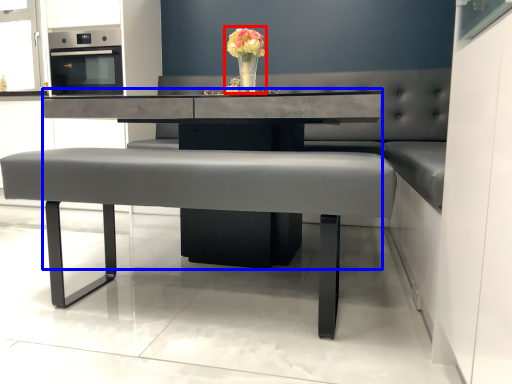
Question: Which point is further to the camera, floral arrangement (highlighted by a red box) or round table (highlighted by a blue box)?

Choices:
 (A) floral arrangement
 (B) round table

Answer: (A)